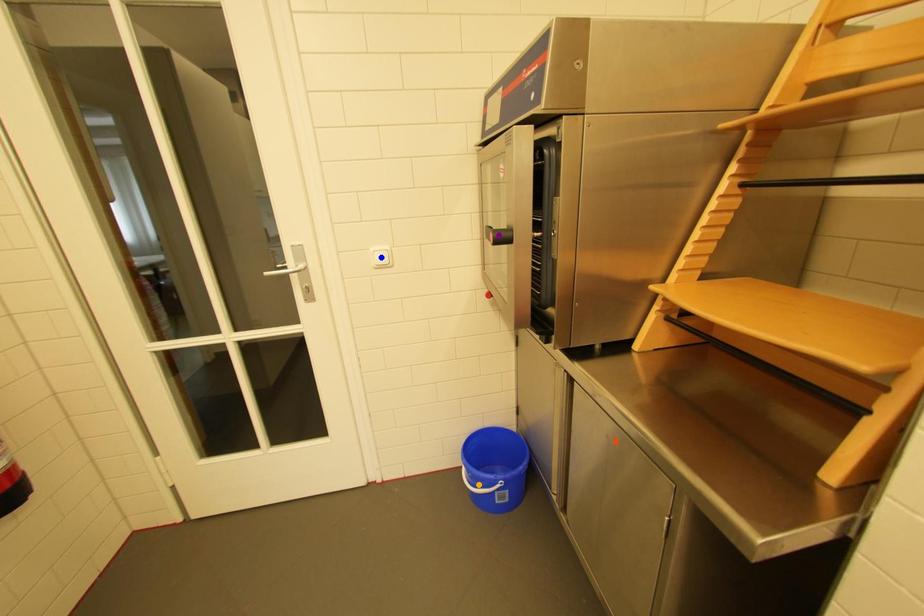
Order these from farthest to nearest:
blue point | orange point | purple point

orange point
blue point
purple point